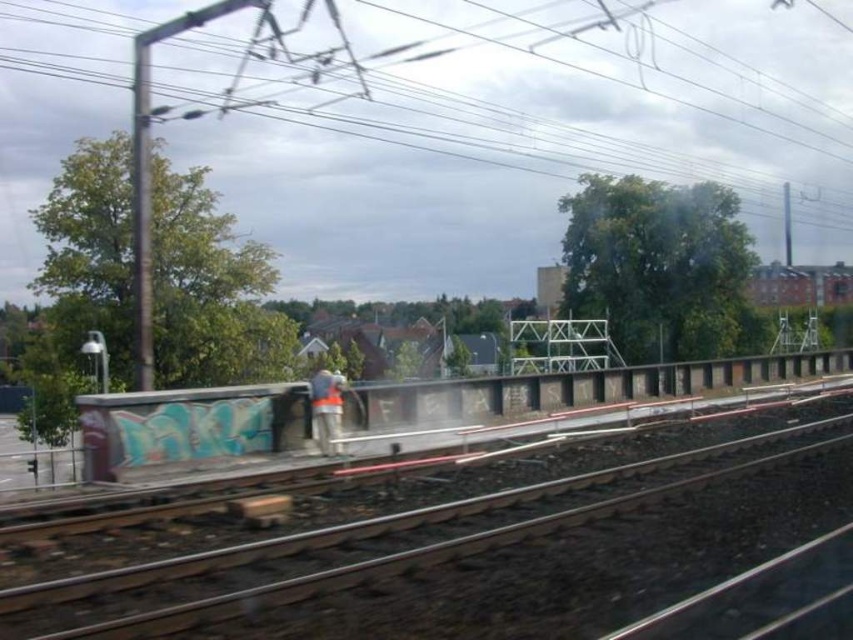
Does metal track at center appear on the right side of orange reflective vest at center?

Indeed, metal track at center is positioned on the right side of orange reflective vest at center.

Which is in front, point (267, 616) or point (334, 444)?

Point (267, 616)

Who is more distant from viewer, (234, 634) or (338, 445)?

The point (338, 445) is more distant.

The height and width of the screenshot is (640, 853). Identify the location of metal track at center. (482, 545).

Who is more distant from viewer, (x=751, y=106) or (x=312, y=374)?

Positioned behind is point (x=751, y=106).

Between metallic wire at upper center and orange reflective vest at center, which one is positioned higher?

metallic wire at upper center is above.

Identify the location of metallic wire at upper center. (611, 97).

The image size is (853, 640). What are the coordinates of `metallic wire at upper center` in the screenshot? It's located at (611, 97).

Who is more forward, (x=816, y=1) or (x=253, y=589)?

Point (x=253, y=589) is more forward.

Locate an element on the screen. metallic wire at upper center is located at coordinates (611, 97).

This screenshot has width=853, height=640. Find the location of `metallic wire at upper center`. metallic wire at upper center is located at coordinates (611, 97).